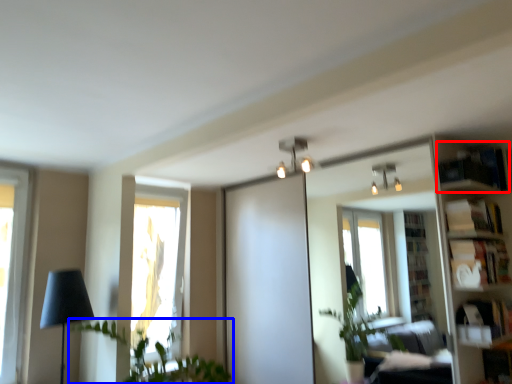
Question: Which object is closer to the camera taking this photo, shelf (highlighted by a red box) or houseplant (highlighted by a blue box)?

Choices:
 (A) shelf
 (B) houseplant

Answer: (B)